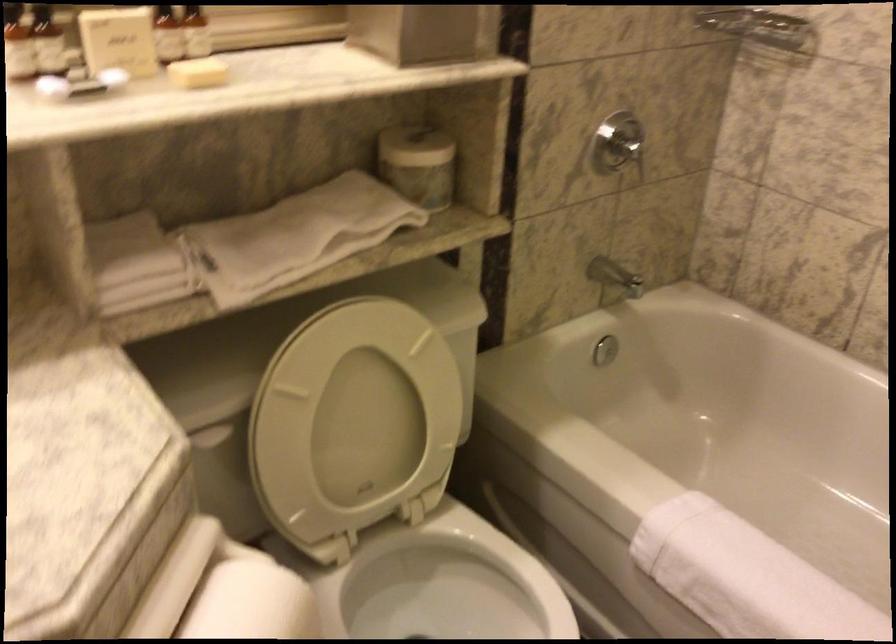
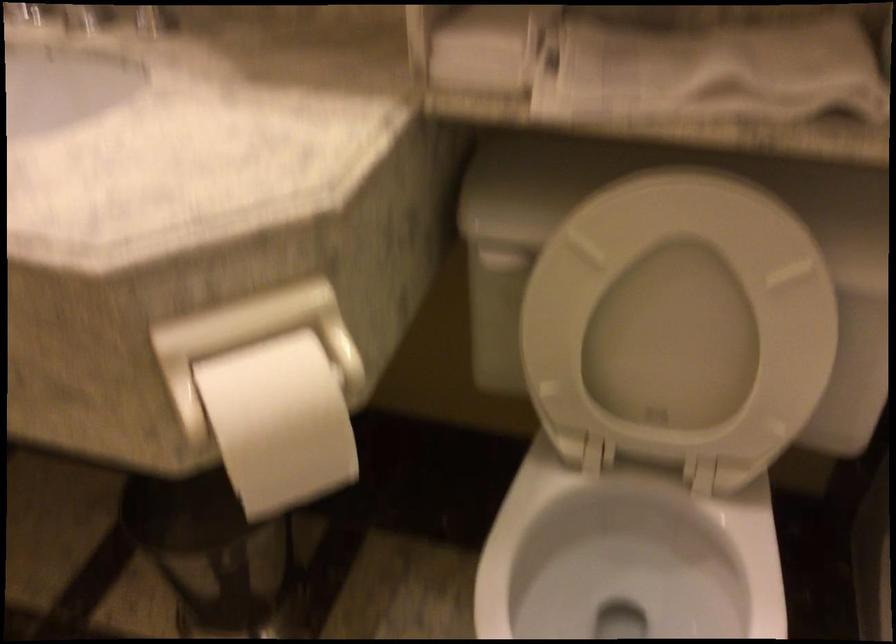
The point at (x=358, y=415) is marked in the first image. Where is the corresponding point in the second image?

(678, 322)